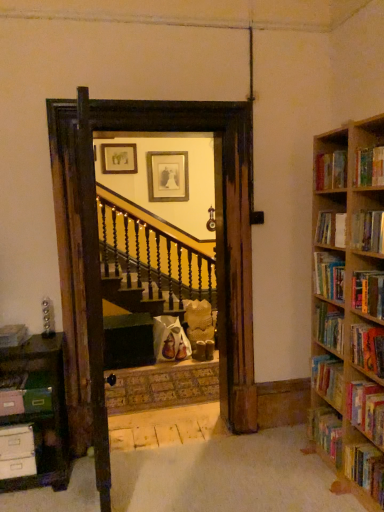
At what (x,y) coordinates should I click in order to perform the action: click on hardcover book at right, placed as the eighth book when sorted from right to left. Please return your answer as a coordinate pair (x, y). Image resolution: width=384 pixels, height=512 pixels. Looking at the image, I should click on (328, 379).

Find the location of a particular element. The width and height of the screenshot is (384, 512). matte gold picture frame at upper center, placed as the first picture frame when sorted from front to back is located at coordinates (119, 158).

Where is `matte pink book at left, the 2th book when ordered from left to right`? The image size is (384, 512). matte pink book at left, the 2th book when ordered from left to right is located at coordinates (26, 394).

Describe the element at coordinates (365, 469) in the screenshot. The image size is (384, 512). I see `hardcover book at right, which is the first book from right to left` at that location.

Image resolution: width=384 pixels, height=512 pixels. Identify the location of matte black bookshelf at left, placed as the 1th book when sorted from left to right. (13, 335).

Describe the element at coordinates (167, 176) in the screenshot. I see `gold-framed picture at center, placed as the second picture frame when sorted from front to back` at that location.

Locate an element on the screen. hardcover book at right, placed as the eighth book when sorted from right to left is located at coordinates (328, 379).

The height and width of the screenshot is (512, 384). In order to click on book that is the 7th object to the right of the hardcover book at right, the 3th book positioned from the left, starting at the anchor in this screenshot , I will do `click(366, 409)`.

Could you tell me if hardcover book at right, arranged as the 10th book when viewed from the left, is turned towards hardcover book at right, the 3th book positioned from the left?

No, hardcover book at right, arranged as the 10th book when viewed from the left, is not aimed at hardcover book at right, the 3th book positioned from the left.

Are hardcover book at right, the 3th book when ordered from right to left, and hardcover book at right, the 10th book viewed from the right, far apart?

No, hardcover book at right, the 3th book when ordered from right to left, is not far from hardcover book at right, the 10th book viewed from the right.

Would you say hardcover book at right, which is the first book from right to left, is part of hardcover book at right, which ranks as the eleventh book in left-to-right order,'s contents?

No, hardcover book at right, which is the first book from right to left, is not a part of hardcover book at right, which ranks as the eleventh book in left-to-right order.

From a real-world perspective, between hardcover book at right, which ranks as the eleventh book in left-to-right order, and hardcover book at right, the twelfth book viewed from the left, who is vertically higher?

hardcover book at right, which ranks as the eleventh book in left-to-right order, is physically above.

Locate an element on the screen. the 4th book below the hardcover book at right, which ranks as the eleventh book in left-to-right order (from a real-world perspective) is located at coordinates (365, 469).

Is point (374, 332) less distant than point (364, 461)?

Yes, point (374, 332) is closer to viewer.

Is hardcover book at right, arranged as the 10th book when viewed from the left, not within hardcover book at upper right, positioned as the 6th book in right-to-left order?

That's correct, hardcover book at right, arranged as the 10th book when viewed from the left, is outside of hardcover book at upper right, positioned as the 6th book in right-to-left order.

What's the angular difference between hardcover book at right, the 3th book when ordered from right to left, and hardcover book at upper right, positioned as the 6th book in right-to-left order,'s facing directions?

0.000306 degrees.

The image size is (384, 512). Find the location of `the 3rd book to the left of the hardcover book at right, arranged as the 10th book when viewed from the left, starting your count from the anchor`. the 3rd book to the left of the hardcover book at right, arranged as the 10th book when viewed from the left, starting your count from the anchor is located at coordinates (369, 167).

Can you confirm if hardcover book at right, which is counted as the second book, starting from the right, is bigger than hardcover book at right, arranged as the 8th book when viewed from the left?

Yes.

Is hardcover book at right, which ranks as the eleventh book in left-to-right order, outside of hardcover book at right, arranged as the 8th book when viewed from the left?

Yes.

From a real-world perspective, relative to hardcover book at right, arranged as the 8th book when viewed from the left, is hardcover book at right, which ranks as the eleventh book in left-to-right order, vertically above or below?

Clearly, from a real-world perspective, hardcover book at right, which ranks as the eleventh book in left-to-right order, is below hardcover book at right, arranged as the 8th book when viewed from the left.

Is hardcover book at right, which ranks as the eleventh book in left-to-right order, far from hardcover book at right, acting as the fifth book starting from the right?

No, hardcover book at right, which ranks as the eleventh book in left-to-right order, is not far from hardcover book at right, acting as the fifth book starting from the right.

How far apart are hardcover book at right, the 3th book when ordered from right to left, and hardcover book at right, the 4th book from the left?

hardcover book at right, the 3th book when ordered from right to left, is 14.20 inches away from hardcover book at right, the 4th book from the left.

What's the angular difference between hardcover book at right, the 3th book when ordered from right to left, and hardcover book at right, the 4th book from the left,'s facing directions?

The angular difference between hardcover book at right, the 3th book when ordered from right to left, and hardcover book at right, the 4th book from the left, is 3.48 degrees.

Choose the correct answer: Is hardcover book at right, the 3th book when ordered from right to left, inside hardcover book at right, the 9th book viewed from the right, or outside it?

hardcover book at right, the 3th book when ordered from right to left, is not enclosed by hardcover book at right, the 9th book viewed from the right.

From the image's perspective, which one is positioned lower, hardcover book at right, the 3th book when ordered from right to left, or hardcover book at right, the 9th book viewed from the right?

hardcover book at right, the 9th book viewed from the right, from the image's perspective.

Is hardcover book at right, the twelfth book viewed from the left, surrounded by hardcover book at right, the 4th book from the left?

No.

Are hardcover book at right, the 4th book from the left, and hardcover book at right, which is the first book from right to left, far apart?

No, hardcover book at right, the 4th book from the left, is in close proximity to hardcover book at right, which is the first book from right to left.

Is hardcover book at right, the 4th book from the left, aimed at hardcover book at right, which is the first book from right to left?

No.

How much distance is there between hardcover book at right, marked as the 9th book in a left-to-right arrangement, and hardcover book at right, which is the first book from right to left?

hardcover book at right, marked as the 9th book in a left-to-right arrangement, is 32.41 inches from hardcover book at right, which is the first book from right to left.

From the image's perspective, which object appears higher, hardcover book at right, the 4th book viewed from the right, or hardcover book at right, the twelfth book viewed from the left?

hardcover book at right, the 4th book viewed from the right, is shown above in the image.

Could you tell me if hardcover book at right, the 4th book viewed from the right, is facing hardcover book at right, which is the first book from right to left?

No, hardcover book at right, the 4th book viewed from the right, is not facing towards hardcover book at right, which is the first book from right to left.

Which book is the 3rd one when counting from the left side of the hardcover book at right, which is the first book from right to left? Please provide its 2D coordinates.

[(368, 292)]

The image size is (384, 512). I want to click on the 6th book below the hardcover book at right, the 3th book positioned from the left (from a real-world perspective), so click(366, 409).

Locate an element on the screen. The image size is (384, 512). book on the right side of hardcover book at right, which ranks as the eleventh book in left-to-right order is located at coordinates (365, 469).

Which object lies nearer to the anchor point hardcover book at right, the 10th book viewed from the right, gold-framed picture at center, placed as the 1th picture frame when sorted from back to front, or hardcover book at right, the 4th book viewed from the right?

The object closer to hardcover book at right, the 10th book viewed from the right, is hardcover book at right, the 4th book viewed from the right.

When comparing their distances from hardcover book at right, acting as the fifth book starting from the left, does gold-framed picture at center, placed as the second picture frame when sorted from front to back, or hardcover book at right, which ranks as the eleventh book in left-to-right order, seem closer?

Among the two, hardcover book at right, which ranks as the eleventh book in left-to-right order, is located nearer to hardcover book at right, acting as the fifth book starting from the left.

From the picture: Considering their positions, is hardcover book at right, the twelfth book viewed from the left, positioned further to matte gold picture frame at upper center, which is counted as the 2th picture frame, starting from the right, than hardcover book at right, acting as the fifth book starting from the left?

Among the two, hardcover book at right, the twelfth book viewed from the left, is located further to matte gold picture frame at upper center, which is counted as the 2th picture frame, starting from the right.

From the image, which object appears to be farther from hardcover book at right, acting as the fifth book starting from the right, matte gold picture frame at upper center, placed as the first picture frame when sorted from front to back, or matte black bookshelf at left, placed as the 1th book when sorted from left to right?

matte gold picture frame at upper center, placed as the first picture frame when sorted from front to back, is positioned further to the anchor hardcover book at right, acting as the fifth book starting from the right.

Estimate the real-world distances between objects in this image. Which object is further from hardcover book at right, acting as the fifth book starting from the right, hardcover book at right, the twelfth book viewed from the left, or matte gold picture frame at upper center, which is counted as the 2th picture frame, starting from the right?

matte gold picture frame at upper center, which is counted as the 2th picture frame, starting from the right, lies further to hardcover book at right, acting as the fifth book starting from the right, than the other object.

When comparing their distances from gold-framed picture at center, which is counted as the second picture frame, starting from the left, does hardcover book at right, placed as the eighth book when sorted from right to left, or hardcover book at right, which ranks as the eleventh book in left-to-right order, seem further?

The object further to gold-framed picture at center, which is counted as the second picture frame, starting from the left, is hardcover book at right, which ranks as the eleventh book in left-to-right order.

Estimate the real-world distances between objects in this image. Which object is further from hardcover book at right, placed as the 6th book when sorted from left to right, hardcover book at right, the 3th book positioned from the left, or matte gold picture frame at upper center, the 1th picture frame from the left?

Among the two, matte gold picture frame at upper center, the 1th picture frame from the left, is located further to hardcover book at right, placed as the 6th book when sorted from left to right.

From the image, which object appears to be nearer to hardcover book at right, which is the first book from right to left, hardcover book at right, placed as the eighth book when sorted from right to left, or hardcover book at right, the 10th book viewed from the right?

hardcover book at right, placed as the eighth book when sorted from right to left.

This screenshot has width=384, height=512. I want to click on picture frame positioned between hardcover book at right, which is counted as the second book, starting from the right, and gold-framed picture at center, which is counted as the second picture frame, starting from the left, from near to far, so click(119, 158).

Locate an element on the screen. Image resolution: width=384 pixels, height=512 pixels. picture frame positioned between hardcover book at right, the 3th book when ordered from right to left, and gold-framed picture at center, which appears as the 1th picture frame when viewed from the right, from near to far is located at coordinates point(119,158).

Locate an element on the screen. This screenshot has width=384, height=512. book located between matte pink book at left, the 2th book when ordered from left to right, and matte gold picture frame at upper center, placed as the first picture frame when sorted from front to back, in the depth direction is located at coordinates (13, 335).

Image resolution: width=384 pixels, height=512 pixels. I want to click on picture frame between hardcover book at right, arranged as the 8th book when viewed from the left, and gold-framed picture at center, placed as the second picture frame when sorted from front to back, along the z-axis, so click(119, 158).